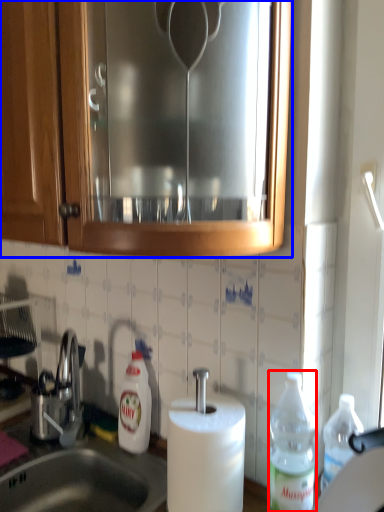
Question: Which object appears farthest to the camera in this image, bottle (highlighted by a red box) or cabinetry (highlighted by a blue box)?

Choices:
 (A) bottle
 (B) cabinetry

Answer: (A)